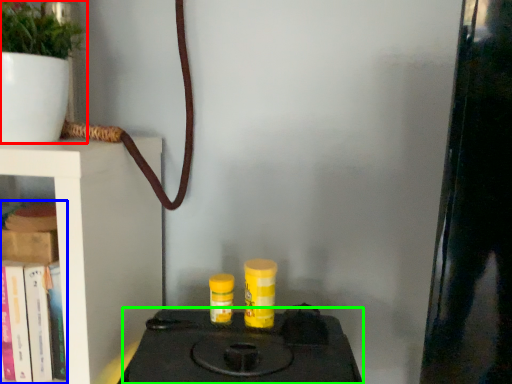
Question: Which object is the farthest from houseplant (highlighted by a red box)? Choose among these: book (highlighted by a blue box) or stove (highlighted by a green box).

Choices:
 (A) book
 (B) stove

Answer: (B)